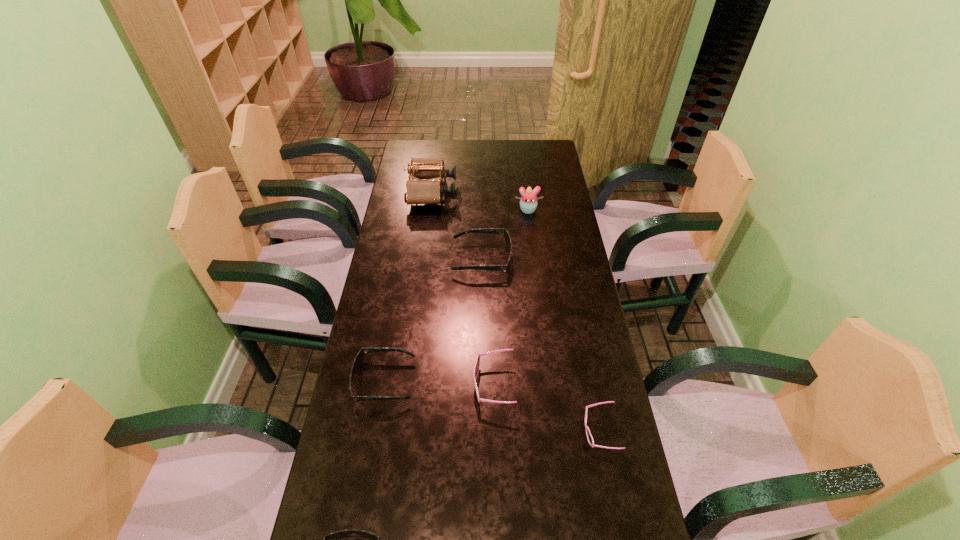
Where is `vacant region located on the front-facing side of the smaller pink sunglasses`? The width and height of the screenshot is (960, 540). vacant region located on the front-facing side of the smaller pink sunglasses is located at coordinates (447, 431).

You are a GUI agent. You are given a task and a screenshot of the screen. Output one action in this format:
    pyautogui.click(x=<x>, y=<y>)
    Task: Click on the binoculars that is at the left edge
    This screenshot has width=960, height=540.
    Given the screenshot: What is the action you would take?
    pyautogui.click(x=418, y=191)

The image size is (960, 540). What are the coordinates of `sunglasses that is at the left edge` in the screenshot? It's located at (358, 360).

You are a GUI agent. You are given a task and a screenshot of the screen. Output one action in this format:
    pyautogui.click(x=<x>, y=<y>)
    Task: Click on the cupcake that is at the right edge
    The image size is (960, 540).
    Given the screenshot: What is the action you would take?
    pyautogui.click(x=528, y=203)

Locate an element on the screen. The height and width of the screenshot is (540, 960). sunglasses that is at the right edge is located at coordinates (589, 437).

The height and width of the screenshot is (540, 960). What are the coordinates of `blank space at the far edge of the desktop` in the screenshot? It's located at (458, 161).

You are a GUI agent. You are given a task and a screenshot of the screen. Output one action in this format:
    pyautogui.click(x=<x>, y=<y>)
    Task: Click on the free space at the left edge
    
    Given the screenshot: What is the action you would take?
    pyautogui.click(x=399, y=172)

Where is `blank space at the right edge of the desktop`? Image resolution: width=960 pixels, height=540 pixels. blank space at the right edge of the desktop is located at coordinates (574, 242).

This screenshot has height=540, width=960. In order to click on free space at the far left corner of the desktop in this screenshot , I will do `click(425, 155)`.

Identify the location of free space between the smaller pink sunglasses and the bigger pink sunglasses. The image size is (960, 540). (546, 408).